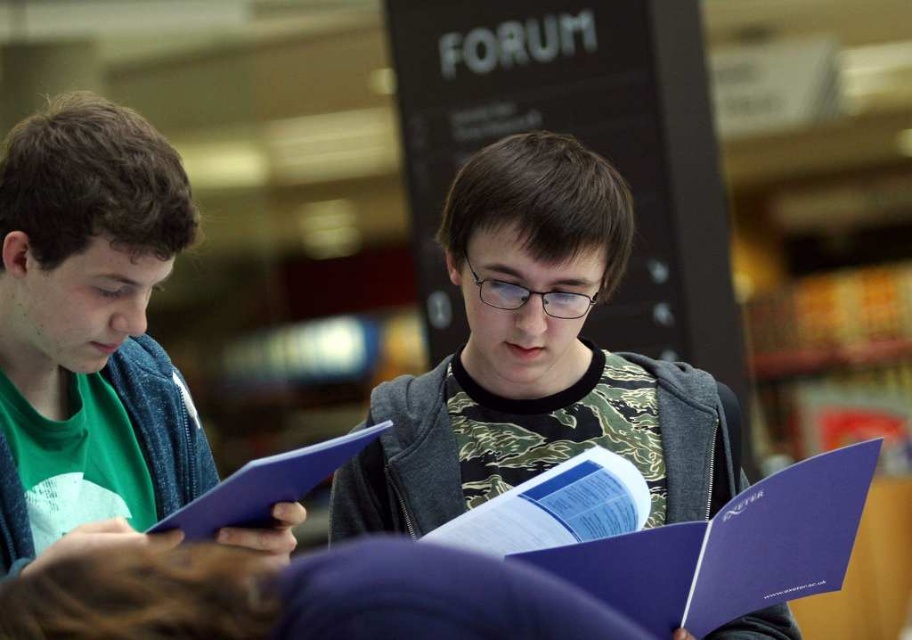
You are a photographer trying to capture a closeup of the matte blue folder at left. Based on its coordinates, where should you position your camera to ensure it is centered in the frame?

The matte blue folder at left is located at coordinates point (90,324). To center it in the frame, position your camera so that the folder aligns with the center point of the image.